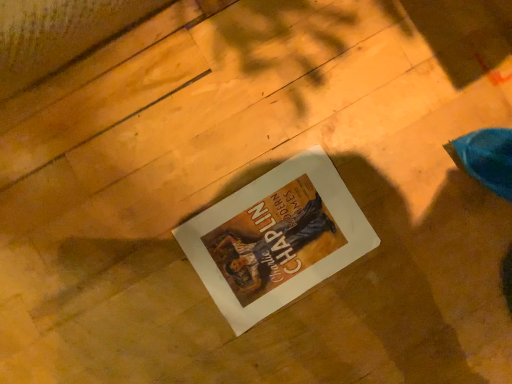
This screenshot has height=384, width=512. Find the location of `free location in front of matte paper poster at center`. free location in front of matte paper poster at center is located at coordinates (173, 326).